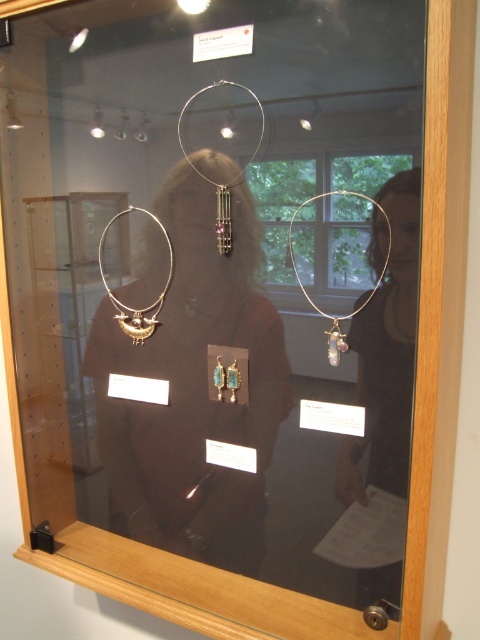
Question: Does matte gold necklace at center have a smaller size compared to silver/metallic hoop at center?

Choices:
 (A) yes
 (B) no

Answer: (B)

Question: Which object is the closest to the gold metallic necklace at upper right?

Choices:
 (A) matte gold necklace at center
 (B) matte silver hoop at center
 (C) gold metallic necklace at center

Answer: (B)

Question: Which of the following is the farthest from the observer?

Choices:
 (A) matte gold necklace at center
 (B) gold metallic necklace at upper right
 (C) matte silver hoop at center

Answer: (A)

Question: Observing the image, what is the correct spatial positioning of matte gold hoop at right in reference to gold metallic necklace at upper right?

Choices:
 (A) right
 (B) left

Answer: (A)

Question: Which object is positioned closest to the gold metallic necklace at center?

Choices:
 (A) gold metallic necklace at upper right
 (B) matte gold hoop at right
 (C) matte silver hoop at center
 (D) matte gold necklace at center

Answer: (D)

Question: Is gold metallic necklace at upper right smaller than matte silver hoop at center?

Choices:
 (A) no
 (B) yes

Answer: (A)